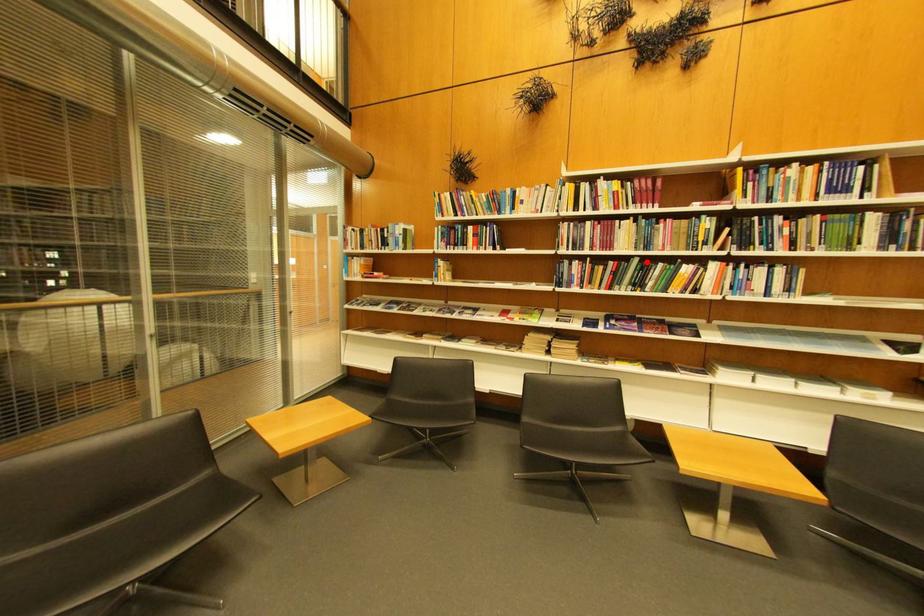
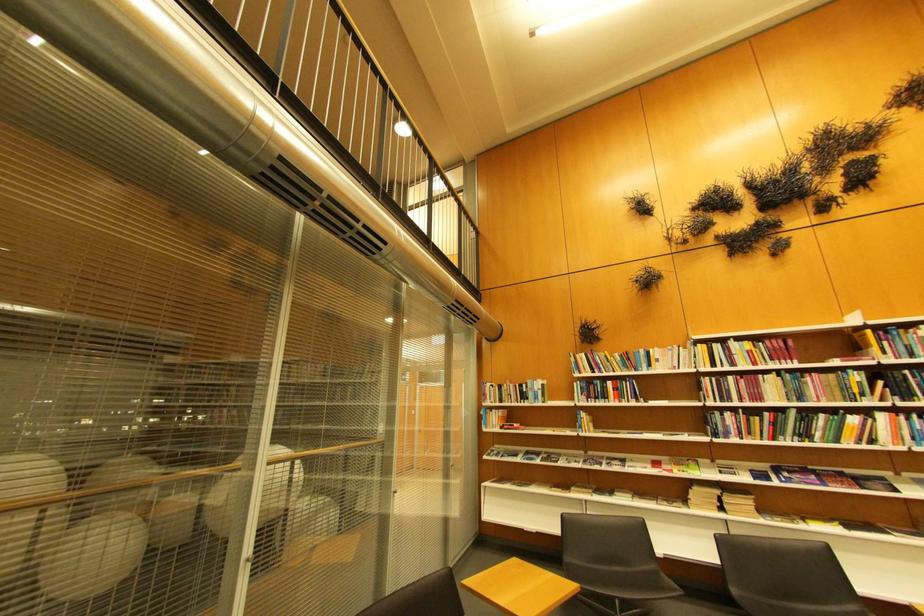
In the second image, find the point that corresponds to the highlighted location in the first image.

(804, 413)